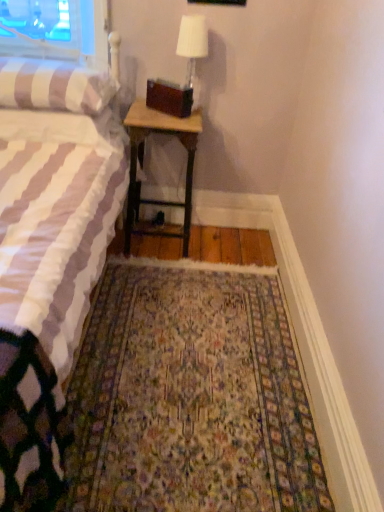
You are a GUI agent. You are given a task and a screenshot of the screen. Output one action in this format:
    pyautogui.click(x=<x>, y=<y>)
    Task: Click on the vacant space to the right of wooden nightstand at center
    
    Given the screenshot: What is the action you would take?
    pyautogui.click(x=223, y=252)